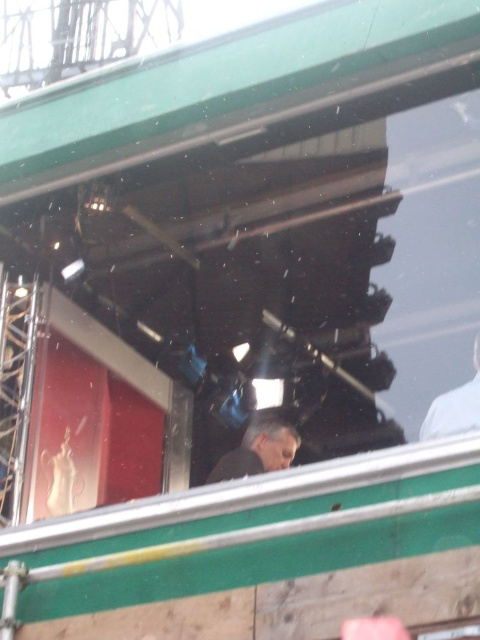
Is gray matte jacket at center wider than white matte shirt at upper right?

Correct, the width of gray matte jacket at center exceeds that of white matte shirt at upper right.

Does gray matte jacket at center have a lesser height compared to white matte shirt at upper right?

Indeed, gray matte jacket at center has a lesser height compared to white matte shirt at upper right.

Who is more distant from viewer, (259, 458) or (479, 333)?

Positioned behind is point (479, 333).

Identify the location of gray matte jacket at center. This screenshot has height=640, width=480. (259, 451).